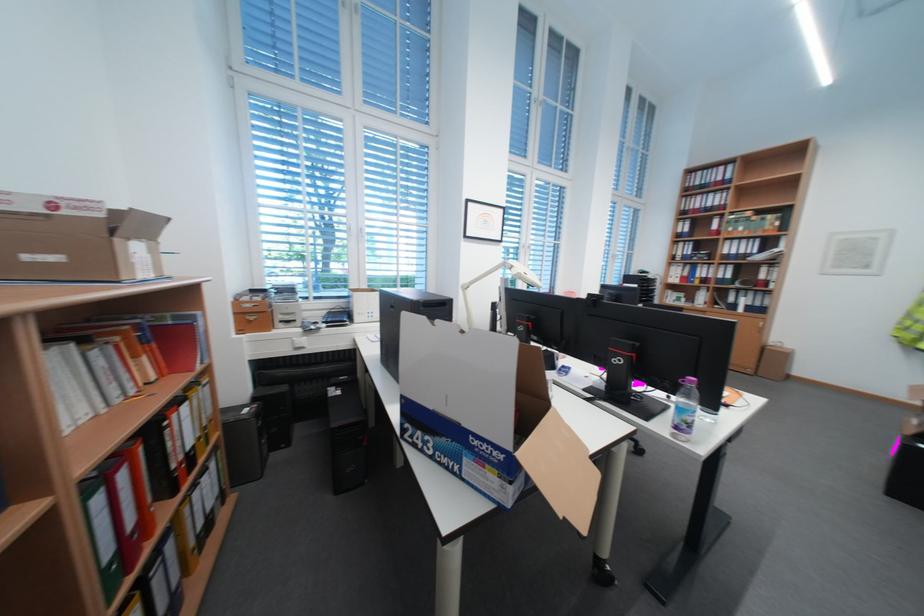
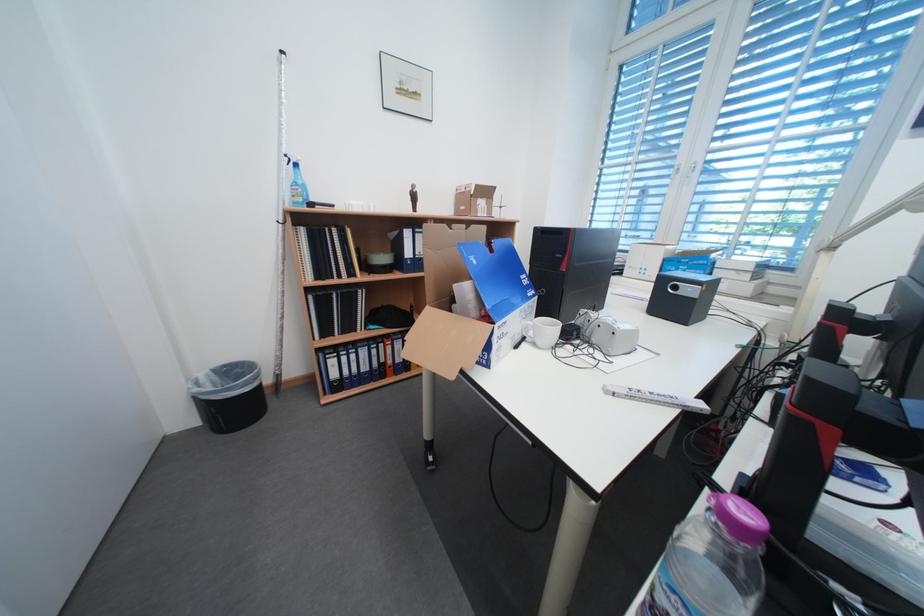
Find the pixel in the second image that matches point 360,229 in the first image.

(688, 171)